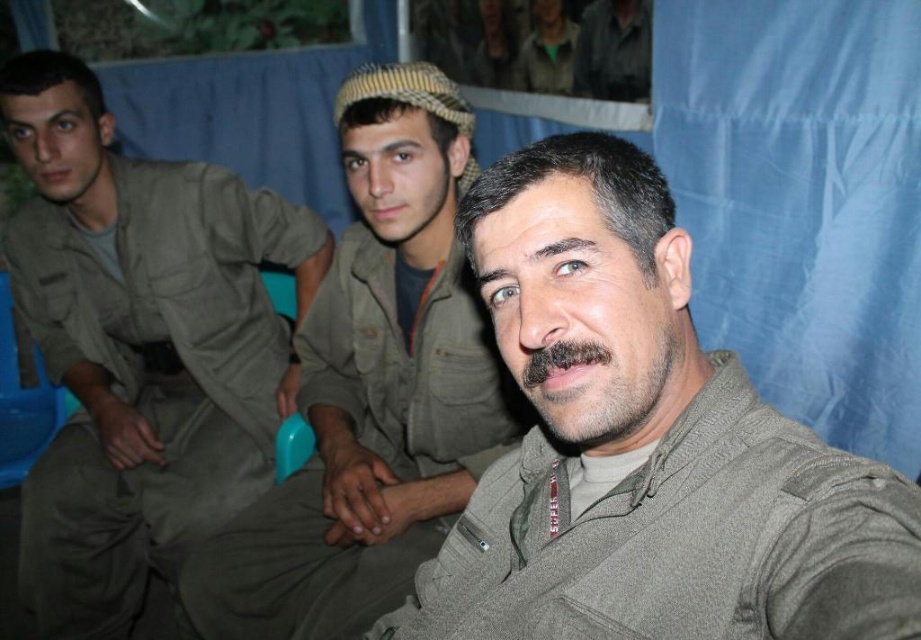
Is point (484, 570) positioned after point (402, 173)?

No, it is in front of (402, 173).

Consider the image. Is the position of gray woolen jacket at center more distant than that of matte khaki uniform at center?

No, gray woolen jacket at center is closer to the viewer.

Between point (601, 465) and point (337, 364), which one is positioned in front?

Point (601, 465) is in front.

This screenshot has height=640, width=921. In order to click on gray woolen jacket at center in this screenshot , I will do point(644,445).

Between matte khaki uniform at left and dark brown fuzzy beard at center, which one is positioned lower?

matte khaki uniform at left

Which of these two, matte khaki uniform at left or dark brown fuzzy beard at center, stands taller?

matte khaki uniform at left

Where is `matte khaki uniform at left`? matte khaki uniform at left is located at coordinates (138, 344).

Find the location of a particular element. The width and height of the screenshot is (921, 640). matte khaki uniform at left is located at coordinates (138, 344).

Does gray woolen jacket at center lie in front of dark brown fuzzy beard at center?

That is True.

Find the location of a particular element. gray woolen jacket at center is located at coordinates (644, 445).

The image size is (921, 640). I want to click on gray woolen jacket at center, so click(x=644, y=445).